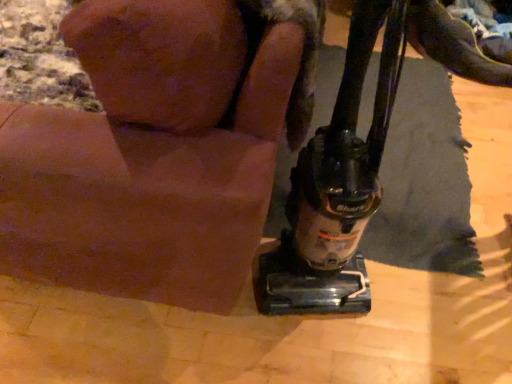
Question: Is point (345, 268) positioned closer to the camera than point (429, 52)?

Choices:
 (A) closer
 (B) farther

Answer: (A)

Question: Considering the relative positions of black plastic vacuum cleaner at lower right and black leather shoe at upper right in the image provided, is black plastic vacuum cleaner at lower right to the left or to the right of black leather shoe at upper right?

Choices:
 (A) left
 (B) right

Answer: (A)

Question: Which of these objects is positioned farthest from the black plastic vacuum cleaner at lower right?

Choices:
 (A) furry brown dog at lower right
 (B) black leather shoe at upper right

Answer: (B)

Question: Which is nearer to the furry brown dog at lower right?

Choices:
 (A) black plastic vacuum cleaner at lower right
 (B) black leather shoe at upper right

Answer: (A)